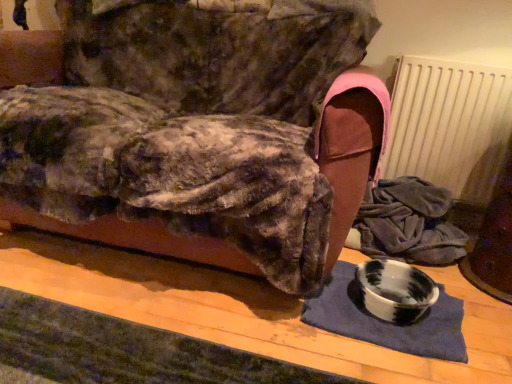
The height and width of the screenshot is (384, 512). What are the coordinates of `free space underneath marbled ceramic bowl at lower right (from a real-world perspective)` in the screenshot? It's located at (391, 294).